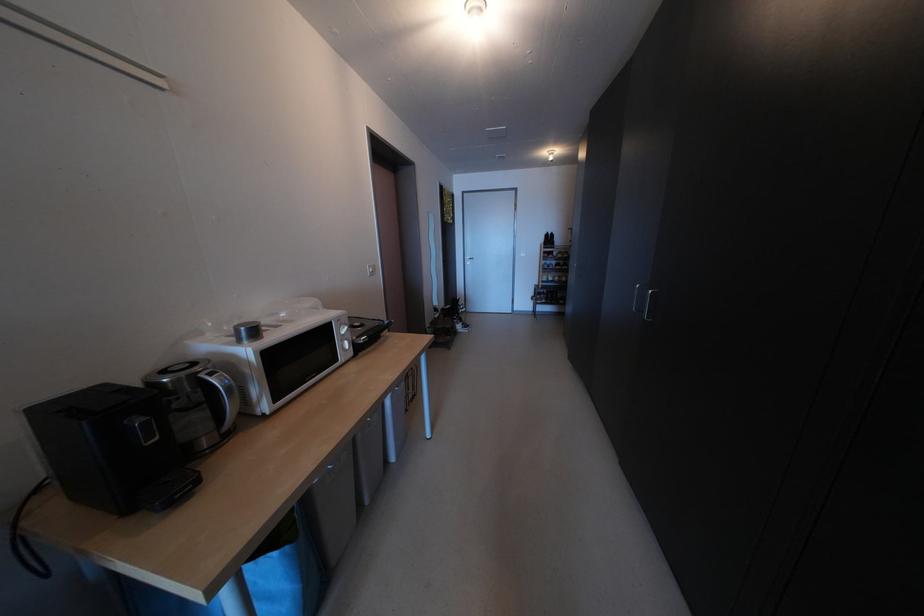
This screenshot has height=616, width=924. In order to click on silver door handle in this screenshot , I will do `click(643, 302)`.